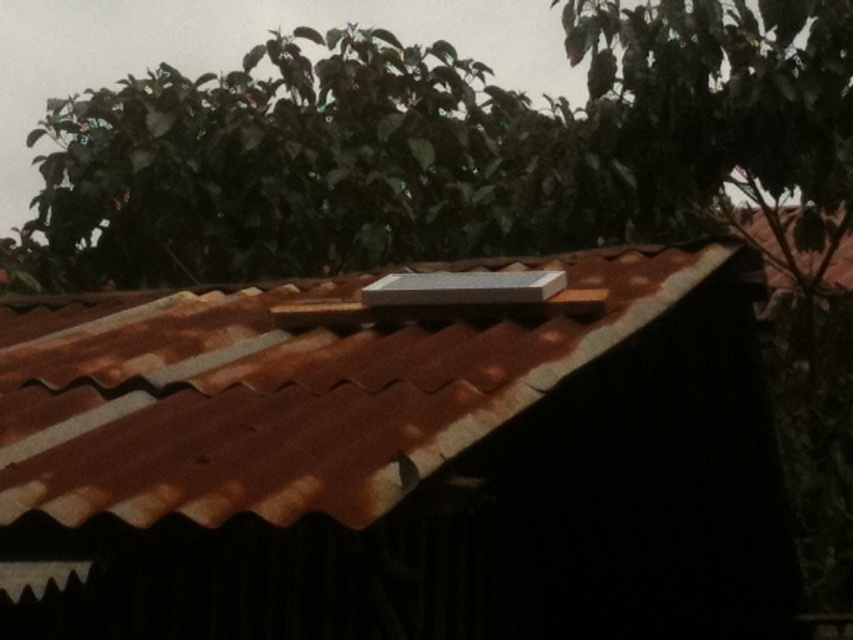
Which is more to the right, rusty metal roof at center or green leafy tree at upper center?

rusty metal roof at center

The height and width of the screenshot is (640, 853). What are the coordinates of `rusty metal roof at center` in the screenshot? It's located at (397, 461).

Measure the distance between rusty metal roof at center and camera.

The distance of rusty metal roof at center from camera is 1.41 meters.

Find the location of `rusty metal roof at center`. rusty metal roof at center is located at coordinates (397, 461).